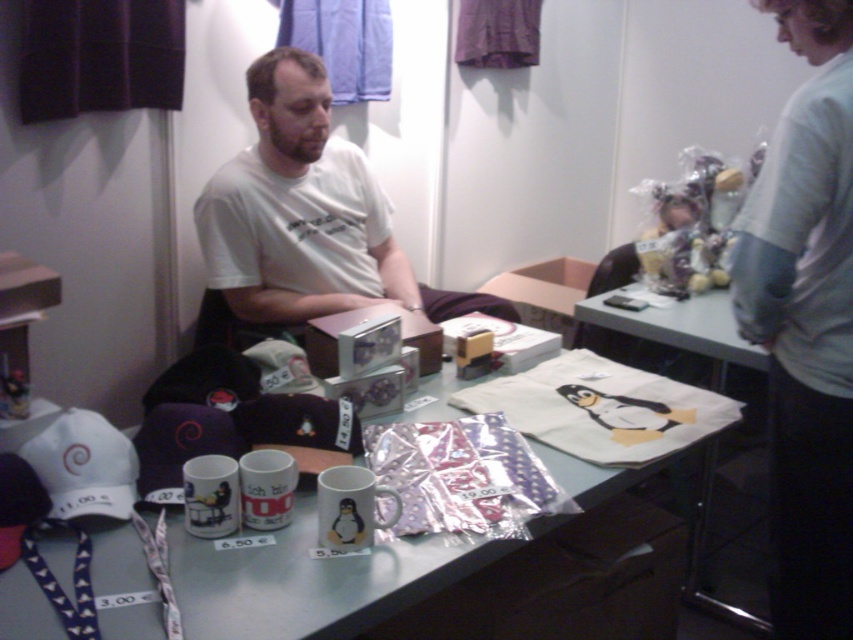
Is point (817, 100) less distant than point (264, 284)?

That is True.

The height and width of the screenshot is (640, 853). What do you see at coordinates (805, 321) in the screenshot? I see `gray sweater at right` at bounding box center [805, 321].

Find the location of `gray sweater at right`. gray sweater at right is located at coordinates (805, 321).

Who is positioned more to the right, white t-shirt at center or white fabric baseball cap at lower left?

Positioned to the right is white t-shirt at center.

Locate an element on the screen. white t-shirt at center is located at coordinates (305, 216).

Does metallic silver table at center have a lesser height compared to white t-shirt at center?

Yes, metallic silver table at center is shorter than white t-shirt at center.

Between point (112, 580) and point (360, 256), which one is positioned in front?

Point (112, 580) is in front.

Image resolution: width=853 pixels, height=640 pixels. Identify the location of metallic silver table at center. (309, 580).